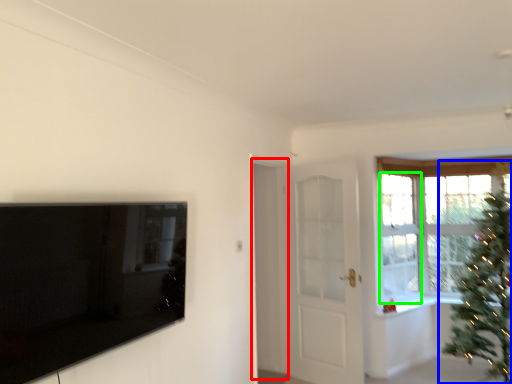
Question: Which is farther away from screen door (highlighted by a red box)? christmas tree (highlighted by a blue box) or window (highlighted by a green box)?

Choices:
 (A) christmas tree
 (B) window

Answer: (A)